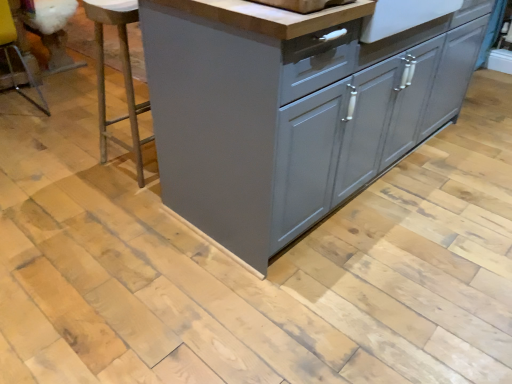
Where is `free space that is in between metallic silver bar stool at left, acting as the 2th bar stool starting from the left, and clear plastic bar stool at left, the second bar stool viewed from the right`? This screenshot has width=512, height=384. free space that is in between metallic silver bar stool at left, acting as the 2th bar stool starting from the left, and clear plastic bar stool at left, the second bar stool viewed from the right is located at coordinates (62, 137).